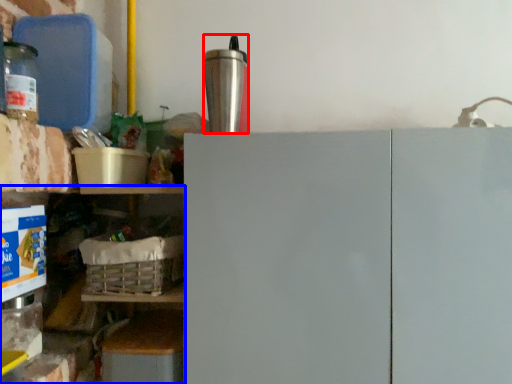
Question: Among these objects, which one is nearest to the camera, appliance (highlighted by a red box) or shelf (highlighted by a blue box)?

Choices:
 (A) appliance
 (B) shelf

Answer: (A)